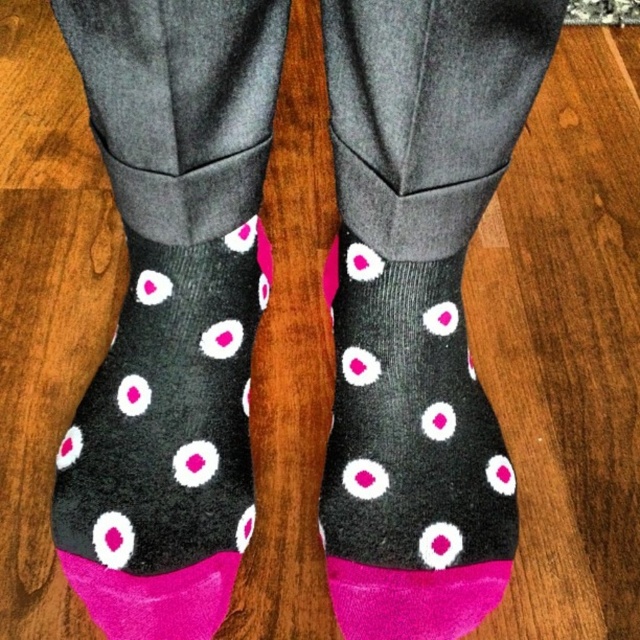
Question: Which object appears farthest from the camera in this image?

Choices:
 (A) pink dotted socks at center
 (B) matte black socks with pink dots at center
 (C) black fuzzy socks at center

Answer: (B)

Question: Observing the image, what is the correct spatial positioning of black fuzzy socks at center in reference to pink dotted socks at center?

Choices:
 (A) above
 (B) below

Answer: (A)

Question: Can you confirm if black fuzzy socks at center is positioned above matte black socks with pink dots at center?

Choices:
 (A) no
 (B) yes

Answer: (B)

Question: Does black fuzzy socks at center appear under pink dotted socks at center?

Choices:
 (A) no
 (B) yes

Answer: (A)

Question: Which point is farther to the camera?

Choices:
 (A) matte black socks with pink dots at center
 (B) pink dotted socks at center
 (C) black fuzzy socks at center

Answer: (A)

Question: Which point appears farthest from the camera in this image?

Choices:
 (A) (156, 493)
 (B) (260, 20)

Answer: (A)